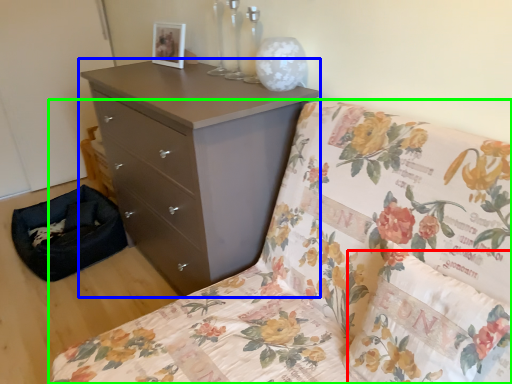
Question: Which object is the closest to the pillow (highlighted by a red box)? Choose among these: chest of drawers (highlighted by a blue box) or furniture (highlighted by a green box).

Choices:
 (A) chest of drawers
 (B) furniture

Answer: (B)